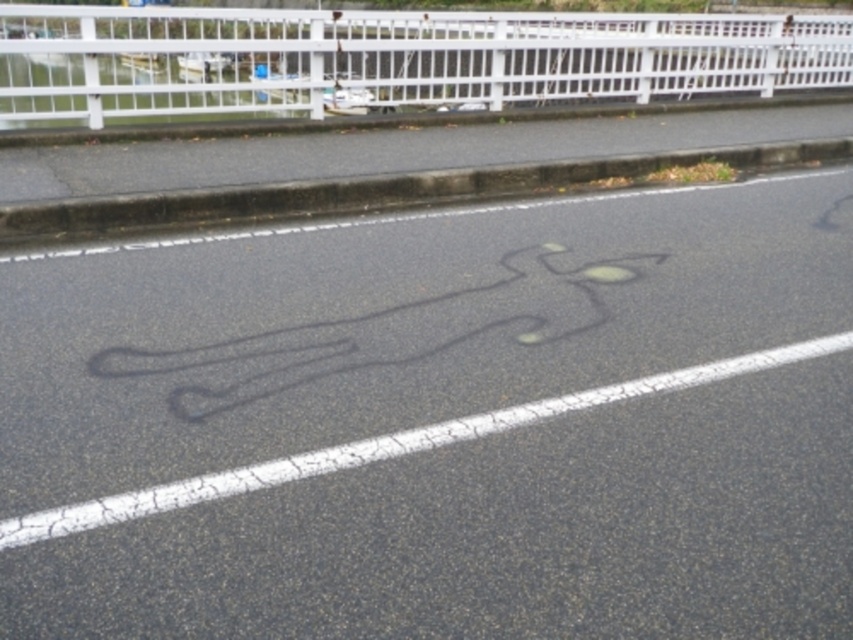
Question: Which point is farther from the camera taking this photo?

Choices:
 (A) (136, 250)
 (B) (241, 100)
 (C) (643, 164)

Answer: (B)

Question: Is white painted metal fence at upper center below black asphalt curb at upper center?

Choices:
 (A) no
 (B) yes

Answer: (A)

Question: Which of the following is the closest to the observer?

Choices:
 (A) pos(364,440)
 (B) pos(189,220)

Answer: (A)

Question: Which object appears closest to the camera in this image?

Choices:
 (A) black asphalt curb at upper center
 (B) white painted metal fence at upper center
 (C) black asphalt bike lane at center

Answer: (C)

Question: Is black asphalt bike lane at center smaller than white painted metal fence at upper center?

Choices:
 (A) no
 (B) yes

Answer: (B)

Question: Considering the relative positions of white painted metal fence at upper center and black asphalt curb at upper center in the image provided, where is white painted metal fence at upper center located with respect to black asphalt curb at upper center?

Choices:
 (A) left
 (B) right

Answer: (A)